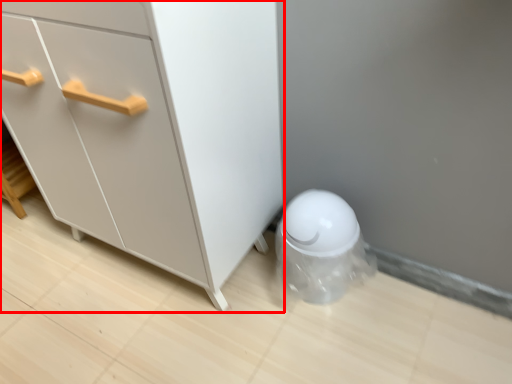
Question: From the image's perspective, what is the correct spatial relationship of chest of drawers (annotated by the red box) in relation to porcelain?

Choices:
 (A) above
 (B) below

Answer: (A)